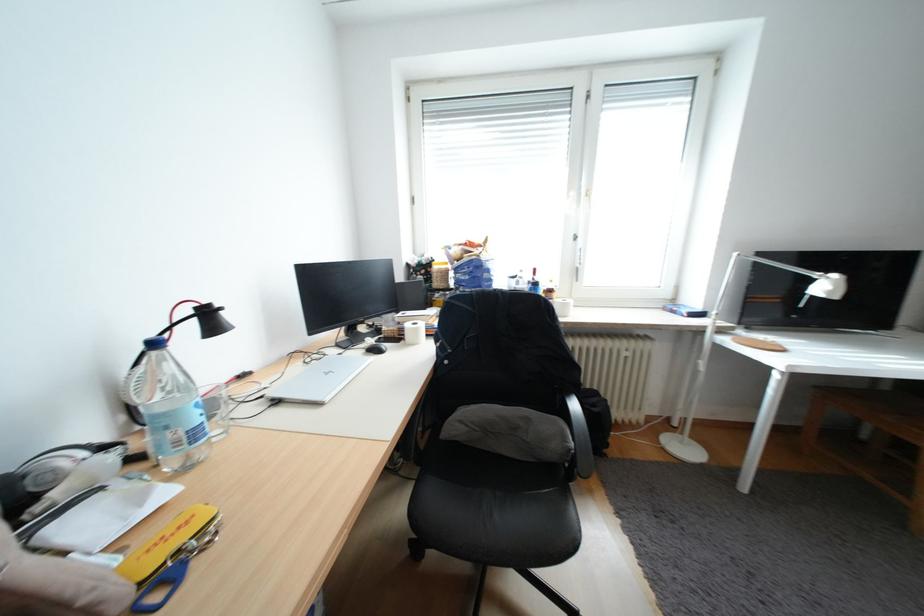
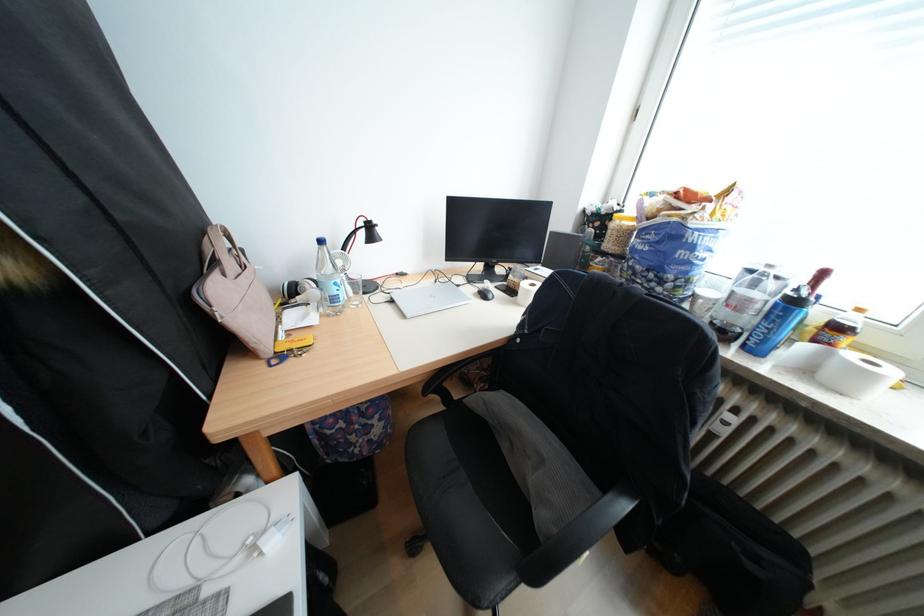
Find the pixel in the second image that matches (608,406) in the first image.

(771, 561)